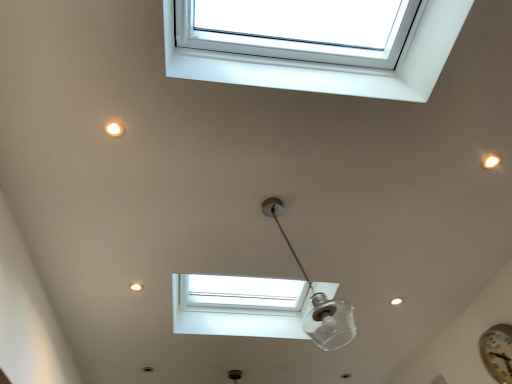
Question: Is metallic silver clock at lower right not inside white plastic window at upper center?

Choices:
 (A) yes
 (B) no

Answer: (A)

Question: Considering the relative positions of metallic silver clock at lower right and white plastic window at upper center in the image provided, is metallic silver clock at lower right to the right of white plastic window at upper center from the viewer's perspective?

Choices:
 (A) yes
 (B) no

Answer: (A)

Question: Considering the relative sizes of metallic silver clock at lower right and white plastic window at upper center in the image provided, is metallic silver clock at lower right wider than white plastic window at upper center?

Choices:
 (A) yes
 (B) no

Answer: (B)

Question: Considering the relative sizes of metallic silver clock at lower right and white plastic window at upper center in the image provided, is metallic silver clock at lower right thinner than white plastic window at upper center?

Choices:
 (A) no
 (B) yes

Answer: (B)

Question: Is metallic silver clock at lower right behind white plastic window at upper center?

Choices:
 (A) no
 (B) yes

Answer: (B)

Question: Does metallic silver clock at lower right have a greater height compared to white plastic window at upper center?

Choices:
 (A) no
 (B) yes

Answer: (A)

Question: Can you confirm if white plastic window at upper center is shorter than metallic silver clock at lower right?

Choices:
 (A) no
 (B) yes

Answer: (A)

Question: Is white plastic window at upper center taller than metallic silver clock at lower right?

Choices:
 (A) yes
 (B) no

Answer: (A)

Question: Can metallic silver clock at lower right be found inside white plastic window at upper center?

Choices:
 (A) no
 (B) yes

Answer: (A)

Question: From the image's perspective, does white plastic window at upper center appear lower than metallic silver clock at lower right?

Choices:
 (A) no
 (B) yes

Answer: (A)

Question: Considering the relative positions of white plastic window at upper center and metallic silver clock at lower right in the image provided, is white plastic window at upper center in front of metallic silver clock at lower right?

Choices:
 (A) no
 (B) yes

Answer: (B)

Question: Can you confirm if white plastic window at upper center is positioned to the left of metallic silver clock at lower right?

Choices:
 (A) no
 (B) yes

Answer: (B)

Question: Can you confirm if transparent glass lamp at center is positioned to the left of white plastic window at upper center?

Choices:
 (A) no
 (B) yes

Answer: (A)